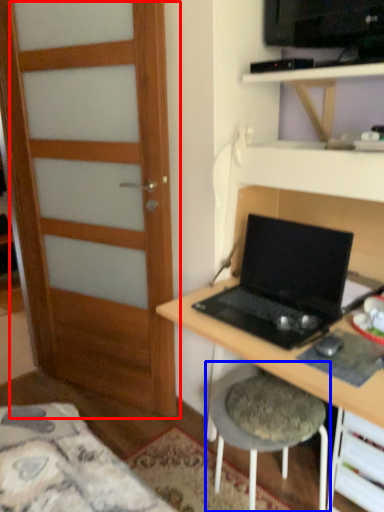
Question: Which object is further to the camera taking this photo, door (highlighted by a red box) or stool (highlighted by a blue box)?

Choices:
 (A) door
 (B) stool

Answer: (A)